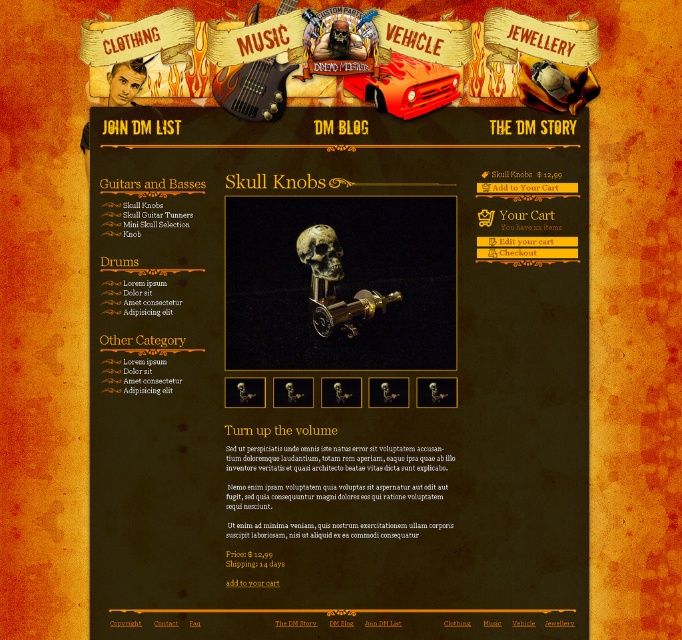
Question: Which point is farther from the camera taking this photo?

Choices:
 (A) (336, 240)
 (B) (394, 99)

Answer: (A)

Question: Where is red matte vehicle at center located in relation to gold metallic skull at center in the image?

Choices:
 (A) left
 (B) right

Answer: (B)

Question: Among these objects, which one is farthest from the camera?

Choices:
 (A) red matte vehicle at center
 (B) gold metallic skull at center

Answer: (B)

Question: In this image, where is red matte vehicle at center located relative to gold metallic skull at center?

Choices:
 (A) below
 (B) above

Answer: (B)

Question: Which point is farther to the camera?

Choices:
 (A) (306, 243)
 (B) (415, 83)

Answer: (A)

Question: Is red matte vehicle at center to the left of gold metallic skull at center from the viewer's perspective?

Choices:
 (A) no
 (B) yes

Answer: (A)